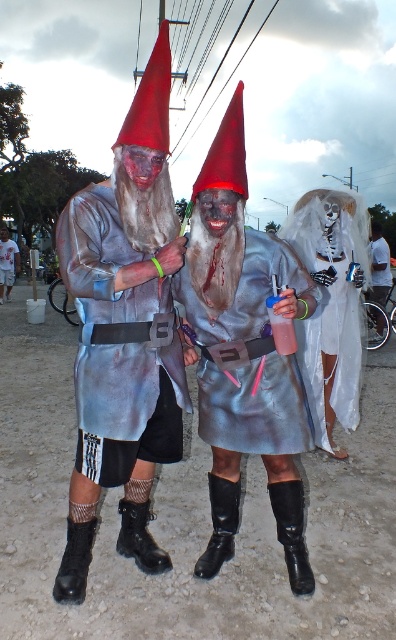
You are organizing a costume parade and need to arrange the white sheer fabric ghost at center and the metallic silver costume at center in a line. Which costume should be placed first if you want the larger one to come before the smaller one?

The white sheer fabric ghost at center should be placed first because it has a larger size compared to the metallic silver costume at center.

You are a photographer at the event and want to capture a photo that shows both the matte silver costume at center and the metallic silver costume at center clearly. Based on their positions, which one should you focus on first to ensure it appears sharp in the photo?

The matte silver costume at center is above the metallic silver costume at center, so focusing on the matte silver costume at center first will ensure it is sharp, and the metallic silver costume at center may also be in focus depending on the camera settings.

You are standing in the center of the scene and want to move towards the point marked at coordinates (112, 317). Which direction should you go to reach that point?

The point at coordinates (112, 317) is on the brushed silver robe at center, so you should move towards the center of the scene to reach it.